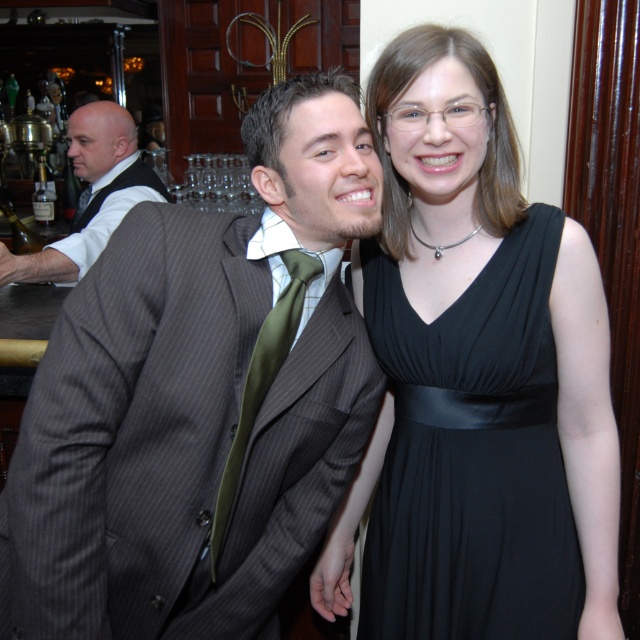
You are a photographer at a social event and need to adjust the lighting so that both the black satin dress at center and the green silk tie at center are equally illuminated. Since one is taller than the other, how should you position the lights?

The black satin dress at center is taller than the green silk tie at center. To ensure both are equally illuminated, position the lights higher above the black satin dress at center to compensate for its height, while lowering the lights slightly near the green silk tie at center.